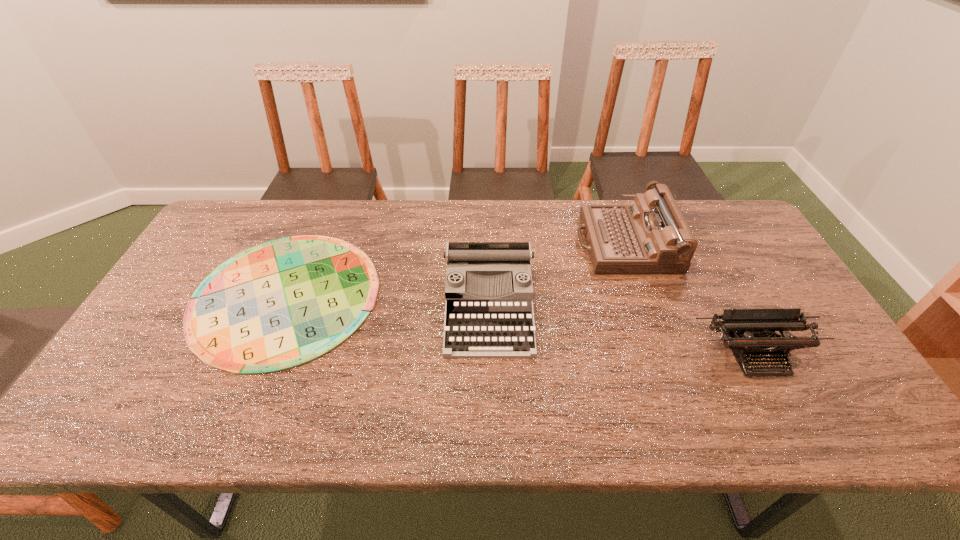
The height and width of the screenshot is (540, 960). What are the coordinates of `gameboard that is at the far edge` in the screenshot? It's located at pos(283,303).

Find the location of a particular element. The image size is (960, 540). object that is at the left edge is located at coordinates (283, 303).

Identify the location of object that is at the right edge. click(x=750, y=333).

Find the location of `object at the far left corner`. object at the far left corner is located at coordinates (283, 303).

The height and width of the screenshot is (540, 960). In order to click on vacant area at the far edge in this screenshot , I will do `click(503, 241)`.

Find the location of a particular element. The width and height of the screenshot is (960, 540). vacant space at the near edge of the desktop is located at coordinates (726, 414).

The height and width of the screenshot is (540, 960). What are the coordinates of `vacant space at the right edge` in the screenshot? It's located at (744, 299).

Image resolution: width=960 pixels, height=540 pixels. In order to click on vacant space at the far left corner in this screenshot , I will do `click(269, 199)`.

You are a GUI agent. You are given a task and a screenshot of the screen. Output one action in this format:
    pyautogui.click(x=<x>, y=<y>)
    Task: Click on the blank space at the near left corner
    
    Given the screenshot: What is the action you would take?
    pyautogui.click(x=80, y=426)

Where is `unoccupied position between the leftmost typewriter and the shortest object`? Image resolution: width=960 pixels, height=540 pixels. unoccupied position between the leftmost typewriter and the shortest object is located at coordinates (387, 301).